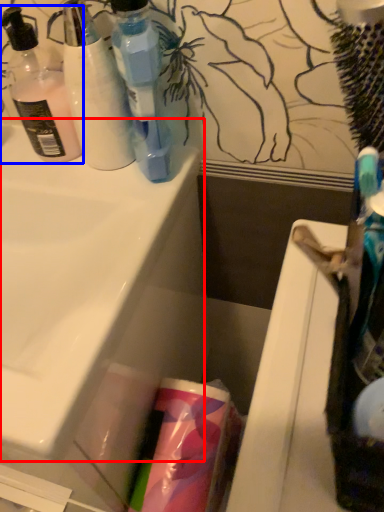
Question: Which object is further to the camera taking this photo, sink (highlighted by a red box) or bottle (highlighted by a blue box)?

Choices:
 (A) sink
 (B) bottle

Answer: (B)